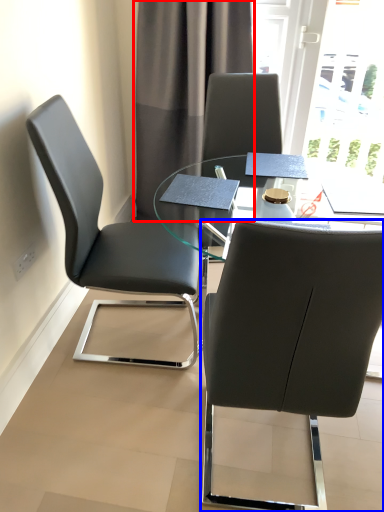
Question: Which point is further to the camera, curtain (highlighted by a red box) or chair (highlighted by a blue box)?

Choices:
 (A) curtain
 (B) chair

Answer: (A)